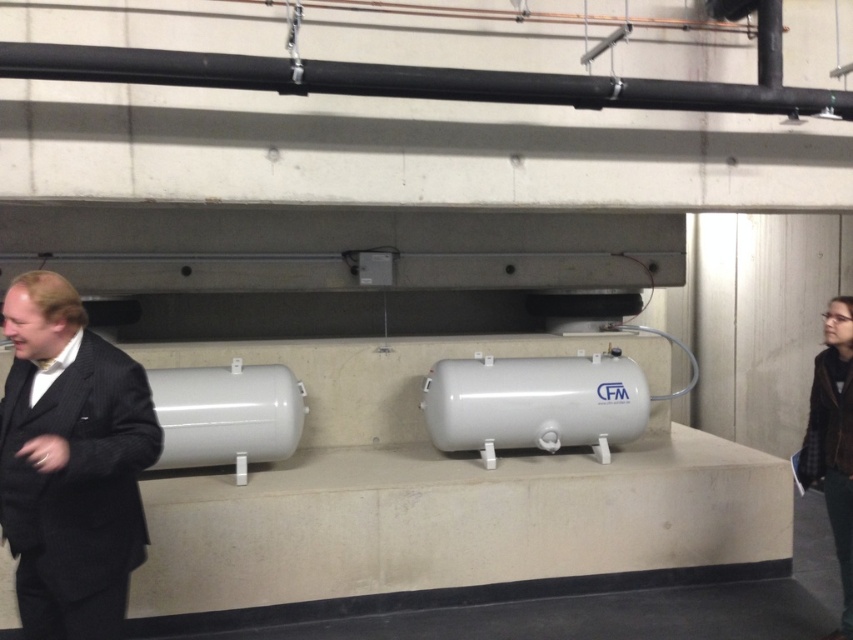
From the picture: You are a maintenance worker needing to reach the black matte pipe at upper center from the dark pinstripe suit at left. Can you safely reach it without moving more than 1.5 meters?

The dark pinstripe suit at left is 1.40 meters from the black matte pipe at upper center, so yes, you can safely reach it without moving more than 1.5 meters.

You are an inspector in an industrial facility. You need to compare the widths of the dark pinstripe suit at left and the black matte pipe at upper center. Which one is wider?

The black matte pipe at upper center is wider than the dark pinstripe suit at left.